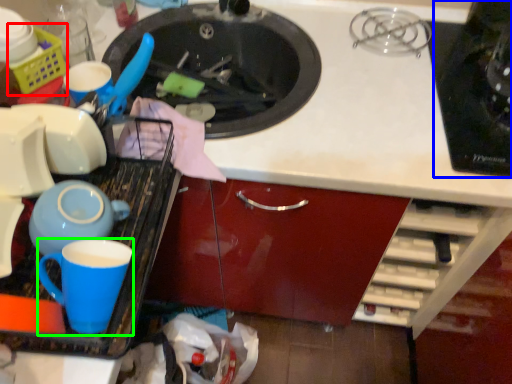
Question: Which object is positioned farthest from basket (highlighted by a red box)? Select from appliance (highlighted by a blue box) and coffee cup (highlighted by a green box).

Choices:
 (A) appliance
 (B) coffee cup

Answer: (A)